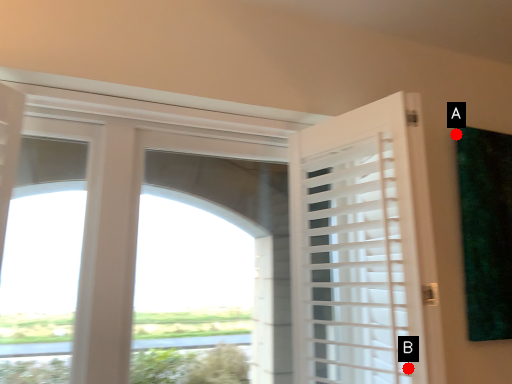
Question: Two points are circled on the image, labeled by A and B beside each circle. Which point is closer to the camera?

Choices:
 (A) A is closer
 (B) B is closer

Answer: (B)